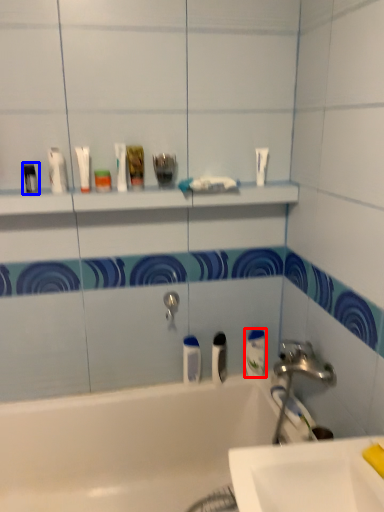
Question: Which object is closer to the camera taking this photo, mouthwash (highlighted by a red box) or toiletry (highlighted by a blue box)?

Choices:
 (A) mouthwash
 (B) toiletry

Answer: (B)